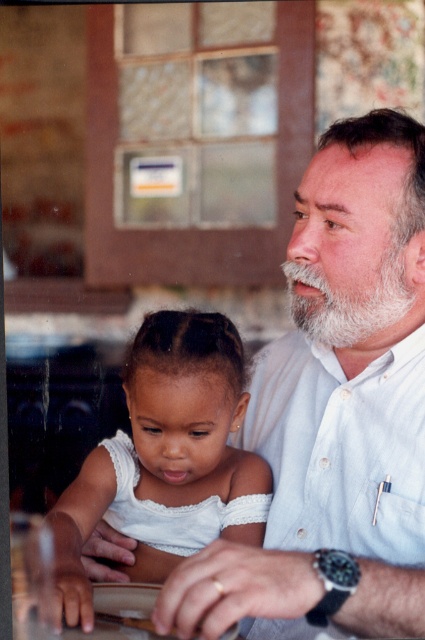
Question: Is the position of white lace dress at center less distant than that of white fuzzy beard at upper right?

Choices:
 (A) yes
 (B) no

Answer: (A)

Question: Which of the following is the closest to the observer?

Choices:
 (A) white shirt at center
 (B) white lace dress at center

Answer: (A)

Question: Which of the following is the farthest from the observer?

Choices:
 (A) (365, 568)
 (B) (328, 312)
 (C) (226, 461)

Answer: (C)

Question: Considering the relative positions of white shirt at center and white fuzzy beard at upper right in the image provided, where is white shirt at center located with respect to white fuzzy beard at upper right?

Choices:
 (A) right
 (B) left

Answer: (B)

Question: In this image, where is white shirt at center located relative to white fuzzy beard at upper right?

Choices:
 (A) right
 (B) left

Answer: (B)

Question: Which object is the farthest from the white fuzzy beard at upper right?

Choices:
 (A) white shirt at center
 (B) white lace dress at center

Answer: (B)